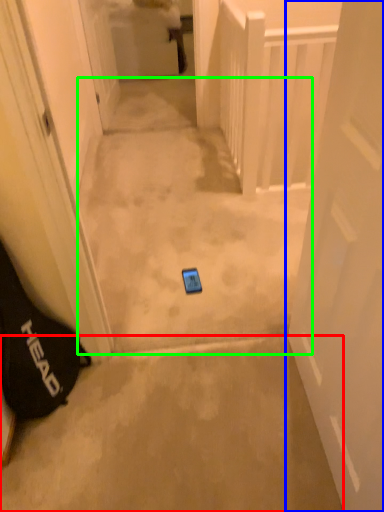
Question: Which object is the farthest from concrete (highlighted by a red box)? Choose among these: door (highlighted by a blue box) or path (highlighted by a green box).

Choices:
 (A) door
 (B) path

Answer: (B)